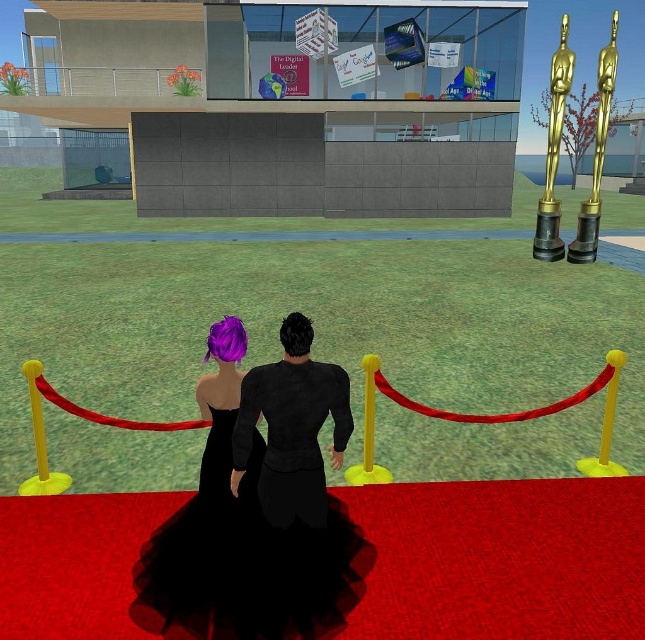
Question: Considering the real-world distances, which object is closest to the black velvet suit at center?

Choices:
 (A) shiny purple hair at center
 (B) black tulle dress at center

Answer: (B)

Question: Among these points, which one is nearest to the camera?

Choices:
 (A) (206, 474)
 (B) (230, 579)

Answer: (B)

Question: Is black tulle dress at center above black velvet suit at center?

Choices:
 (A) no
 (B) yes

Answer: (A)

Question: Is black tulle dress at center positioned before black velvet suit at center?

Choices:
 (A) no
 (B) yes

Answer: (B)

Question: Does black tulle dress at center have a larger size compared to shiny purple hair at center?

Choices:
 (A) no
 (B) yes

Answer: (B)

Question: Which of these objects is positioned farthest from the shiny purple hair at center?

Choices:
 (A) black tulle dress at center
 (B) black velvet suit at center

Answer: (B)